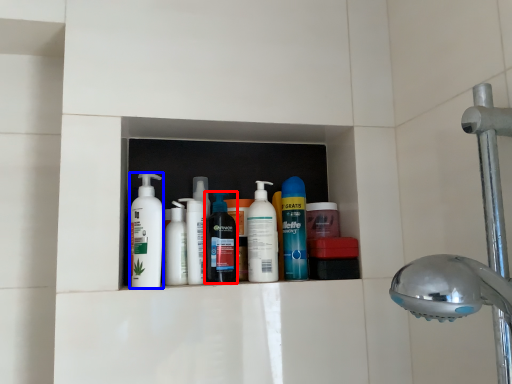
Question: Which object appears farthest to the camera in this image, cleaning product (highlighted by a red box) or cleaning product (highlighted by a blue box)?

Choices:
 (A) cleaning product
 (B) cleaning product

Answer: (A)